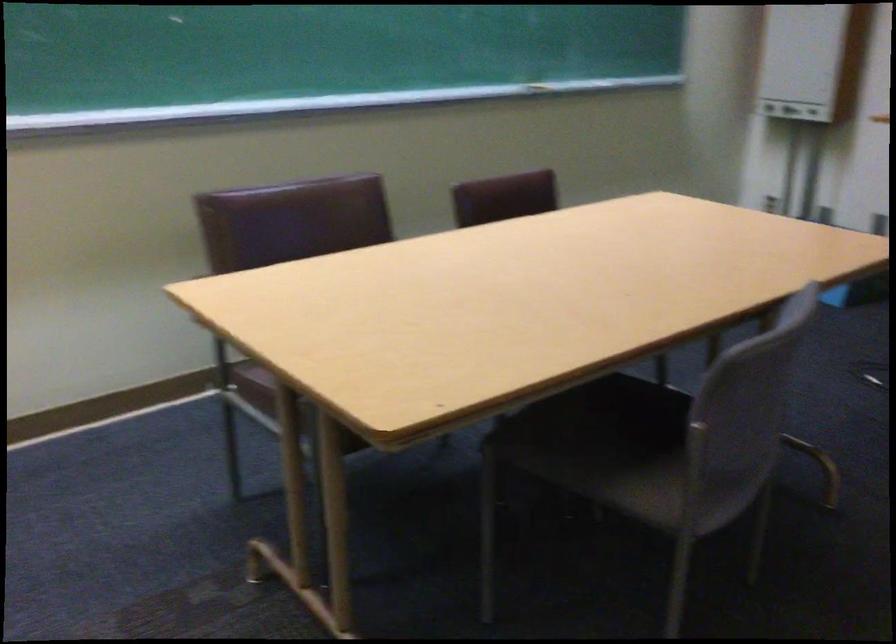
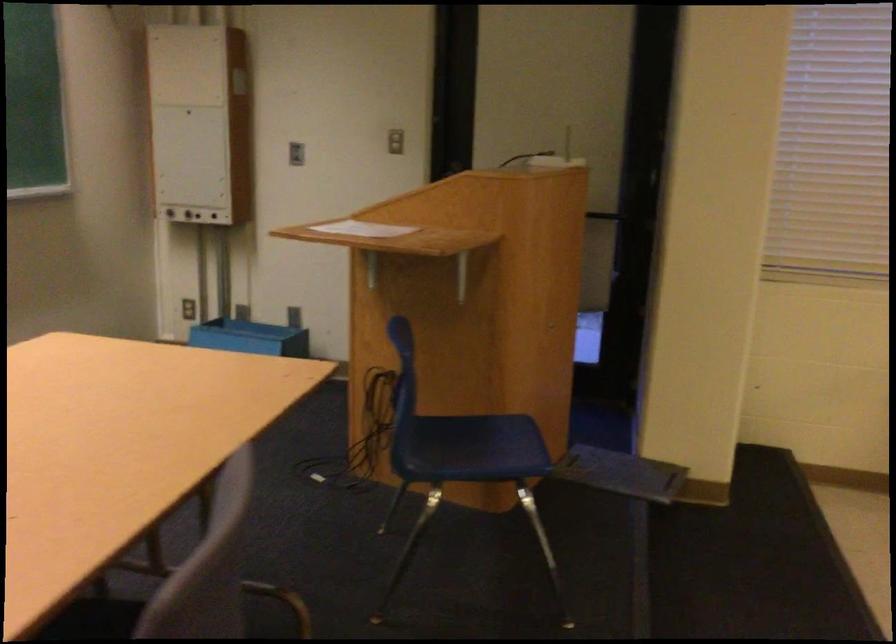
Locate, in the second image, the point that corresponds to (x=753, y=104) in the first image.

(167, 210)